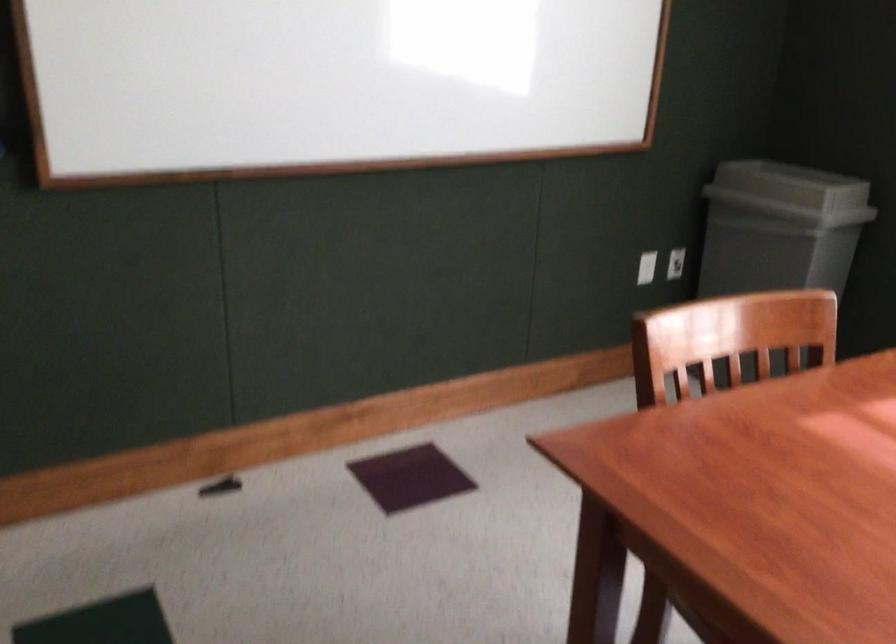
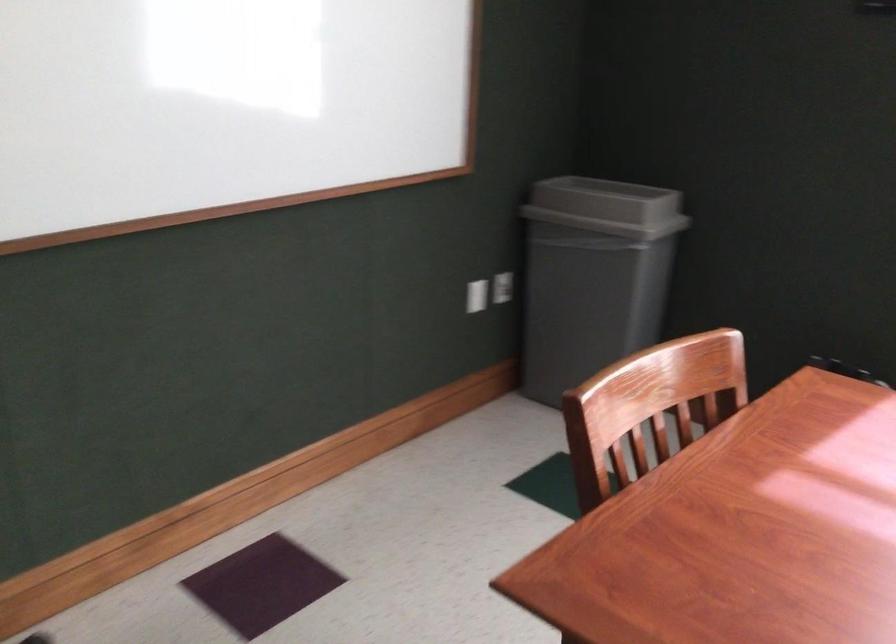
The point at (790, 187) is marked in the first image. Where is the corresponding point in the second image?

(607, 207)